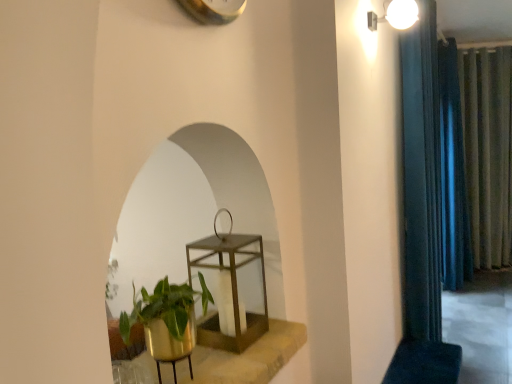
Locate an element on the screen. This screenshot has width=512, height=384. free space to the right of metallic gold lantern at center is located at coordinates tap(274, 334).